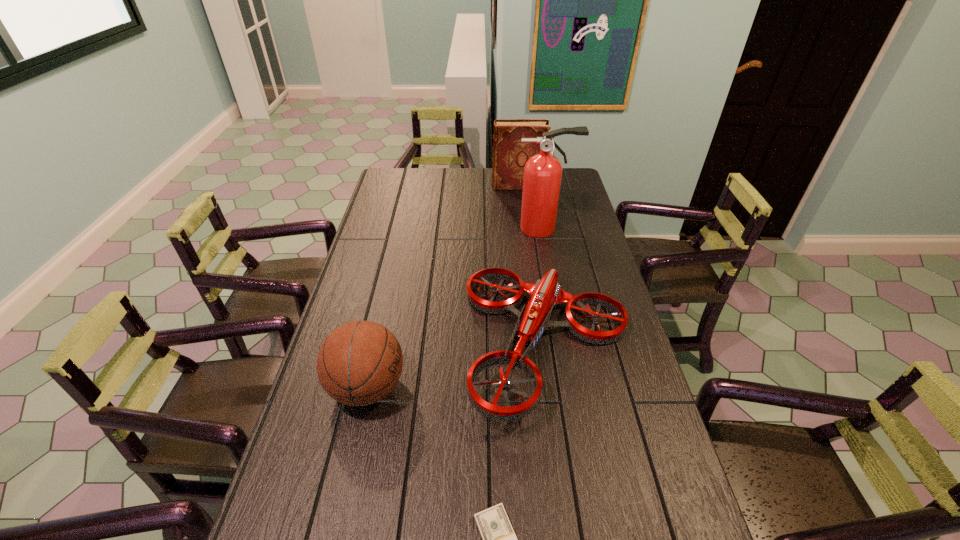
I want to click on free space that satisfies the following two spatial constraints: 1. on the spine side of the tallest object; 2. on the left side of the hardback book, so 523,228.

Where is `vacant position in the image that satisfies the following two spatial constraints: 1. on the spine side of the tallest object; 2. on the right side of the fourth shortest object`? The width and height of the screenshot is (960, 540). vacant position in the image that satisfies the following two spatial constraints: 1. on the spine side of the tallest object; 2. on the right side of the fourth shortest object is located at coordinates (523, 228).

Identify the location of free space that satisfies the following two spatial constraints: 1. on the spine side of the hardback book; 2. on the back side of the second farthest object. (523, 228).

You are a GUI agent. You are given a task and a screenshot of the screen. Output one action in this format:
    pyautogui.click(x=<x>, y=<y>)
    Task: Click on the vacant space that satisfies the following two spatial constraints: 1. on the spine side of the second shortest object; 2. on the right side of the hardback book
    The image size is (960, 540).
    Given the screenshot: What is the action you would take?
    pyautogui.click(x=538, y=343)

Where is `free location that satisfies the following two spatial constraints: 1. on the front side of the second shortest object; 2. on the side with brand label of the third shortest object`? free location that satisfies the following two spatial constraints: 1. on the front side of the second shortest object; 2. on the side with brand label of the third shortest object is located at coordinates (555, 388).